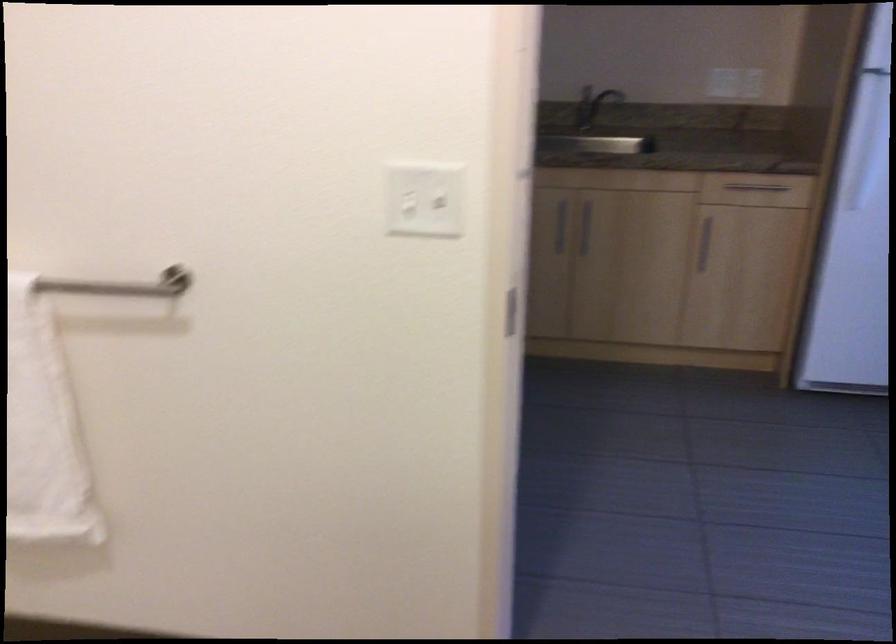
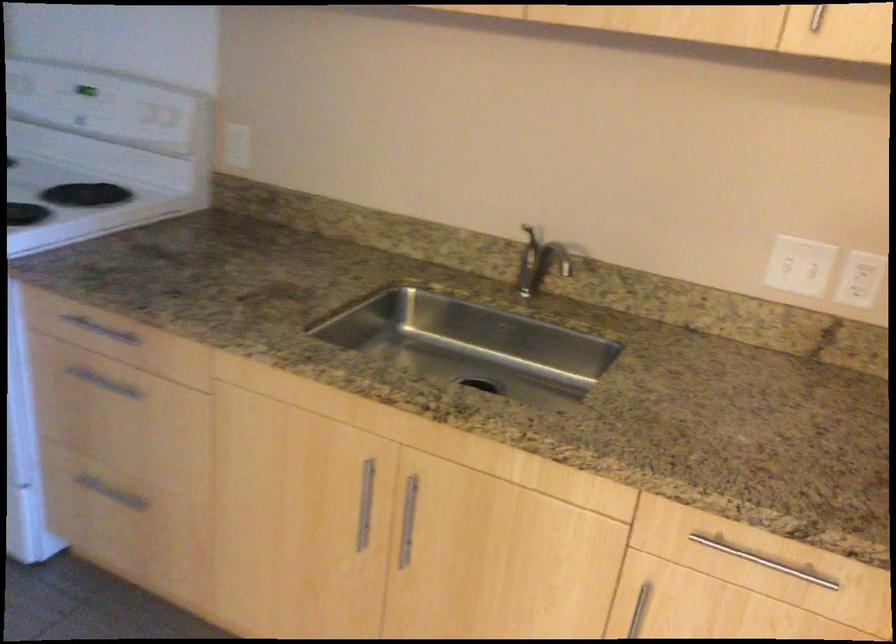
Find the pixel in the second image that matches (x=578, y=230) in the first image.

(408, 520)